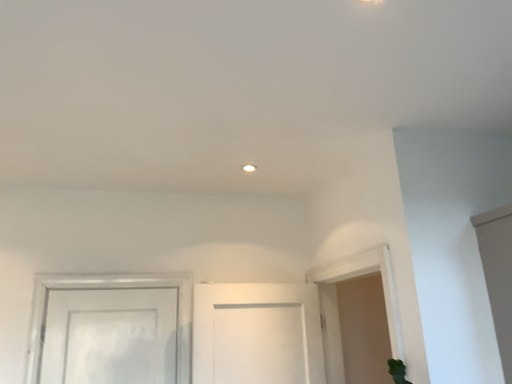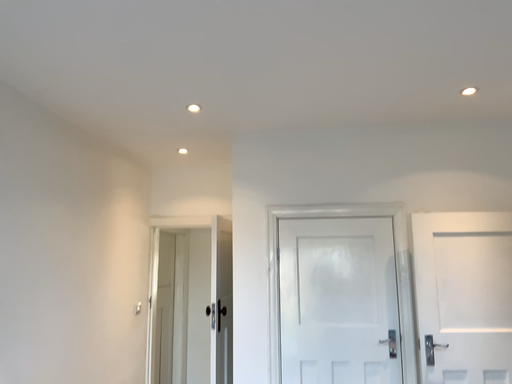
Question: How did the camera likely rotate when shooting the video?

Choices:
 (A) rotated upward
 (B) rotated downward

Answer: (B)